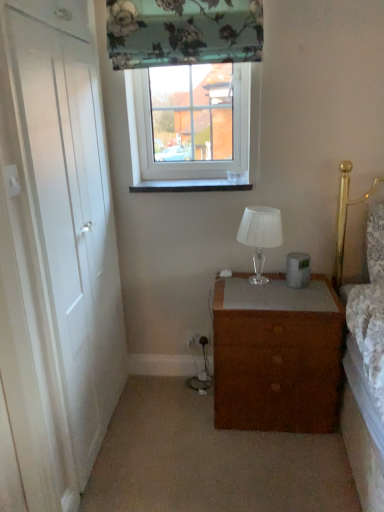
Locate an element on the screen. This screenshot has height=512, width=384. free location in front of brown matte chest of drawers at center is located at coordinates (268, 466).